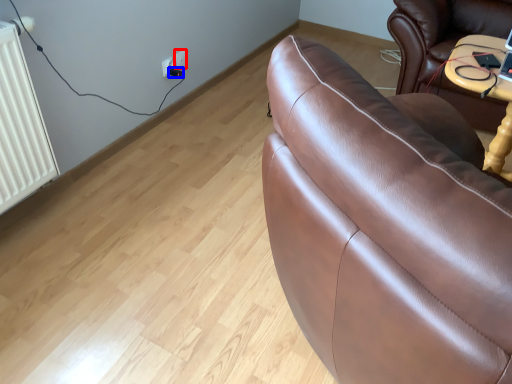
Question: Among these objects, which one is farthest to the camera, electric outlet (highlighted by a red box) or plug (highlighted by a blue box)?

Choices:
 (A) electric outlet
 (B) plug

Answer: (A)